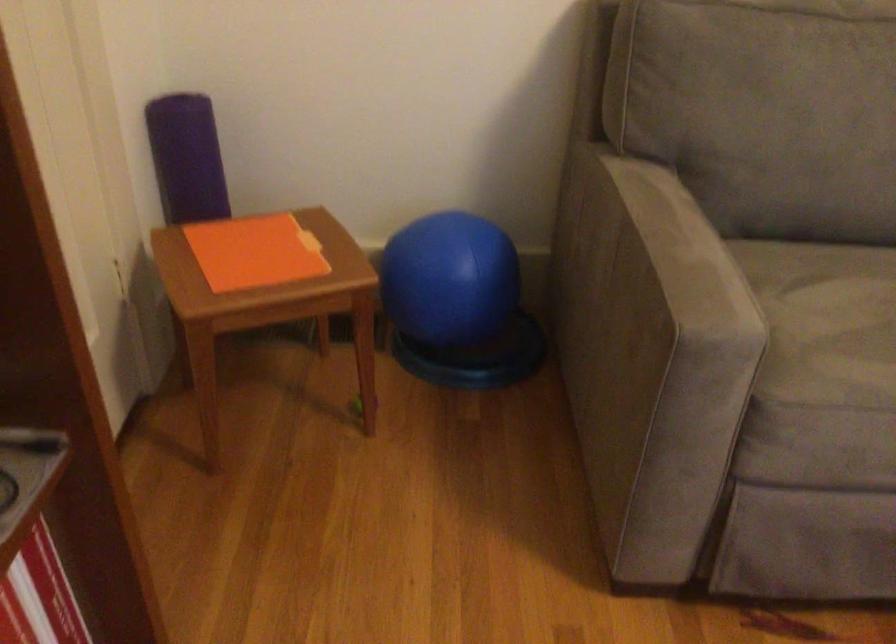
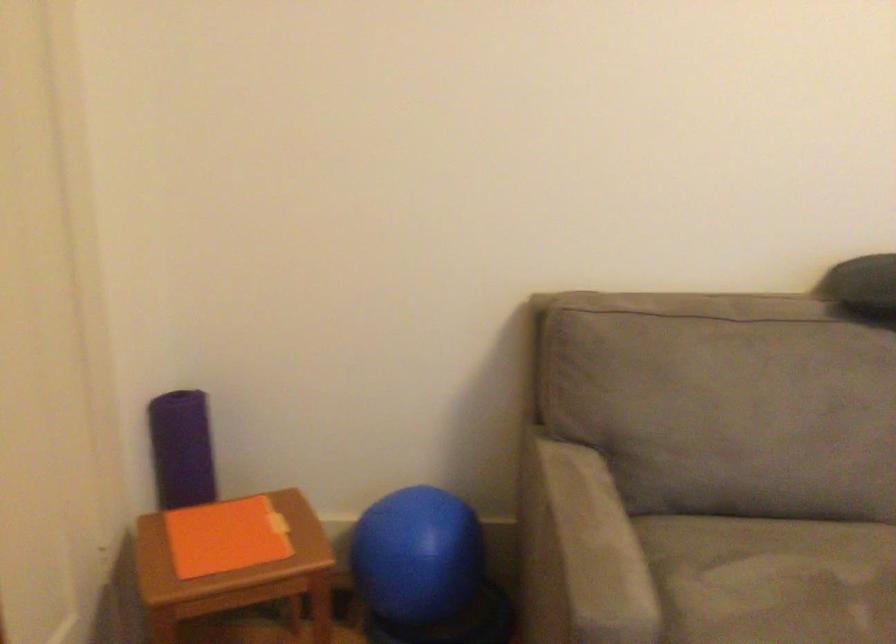
Question: I am providing you with two images of the same scene from different viewpoints. After the viewpoint changes to image2, which objects are now occluded?

Choices:
 (A) sofa armrest
 (B) purple yoga mat
 (C) sofa sitting surface
 (D) none of these

Answer: (D)